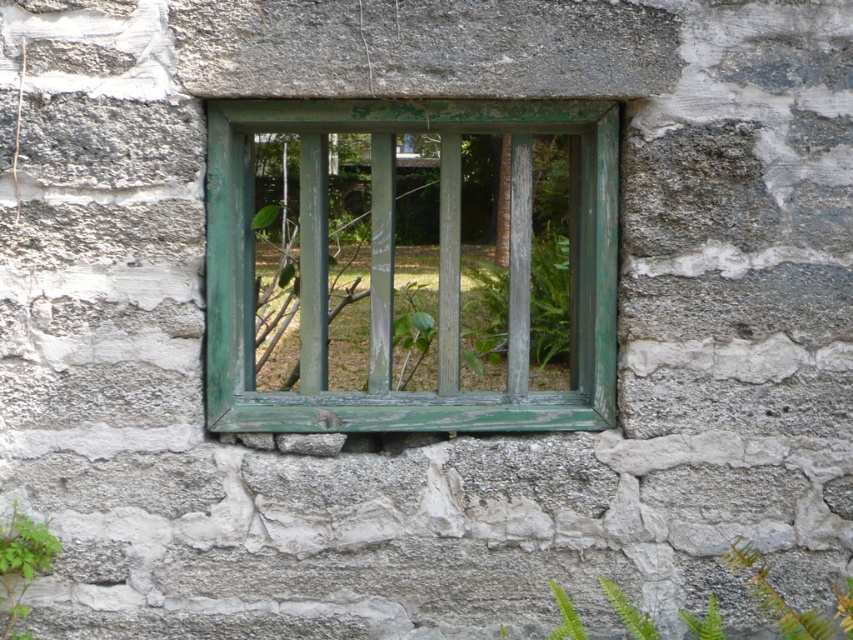
Question: Which point is farther to the camera?

Choices:
 (A) (10, 547)
 (B) (381, 131)

Answer: (B)

Question: Which point is farther from the camera taking this photo?

Choices:
 (A) (26, 544)
 (B) (409, 394)

Answer: (B)

Question: Can you confirm if green weathered wood at center is bigger than green leafy plant at lower left?

Choices:
 (A) no
 (B) yes

Answer: (B)

Question: Does green weathered wood at center have a lesser width compared to green leafy plant at lower left?

Choices:
 (A) no
 (B) yes

Answer: (A)

Question: Does green weathered wood at center appear on the right side of green leafy plant at lower left?

Choices:
 (A) yes
 (B) no

Answer: (A)